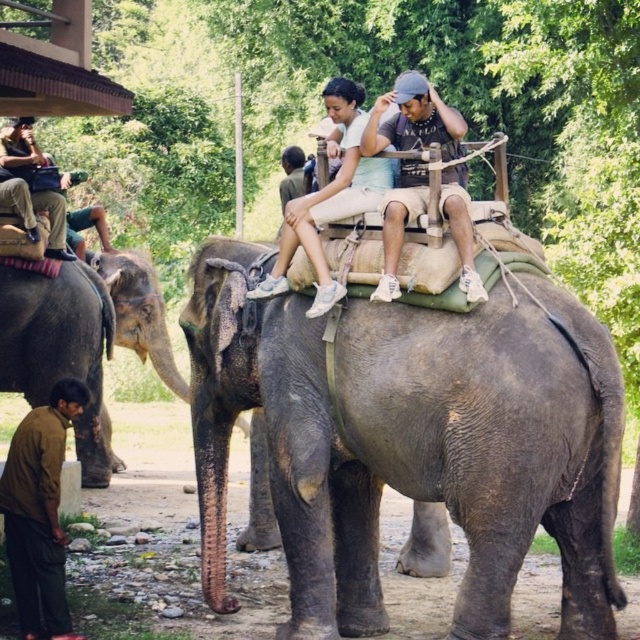
You are a photographer standing at the center of the scene. You want to capture a photo of the gray textured elephant at lower left without including the people in the foreground. Is the elephant positioned in a way that allows this?

The gray textured elephant at lower left is located at point (83, 339), which is positioned such that the photographer can adjust their angle or zoom to exclude the people in the foreground while focusing on the elephant.

You are a photographer trying to capture a closeup of the brown cotton shirt at lower left and the dark gray fabric hat at upper center. Which object should you zoom in on to ensure they both fit in the frame without cropping?

The brown cotton shirt at lower left has a smaller width compared to the dark gray fabric hat at upper center. To ensure both fit in the frame without cropping, you should zoom in on the brown cotton shirt at lower left since it is narrower.